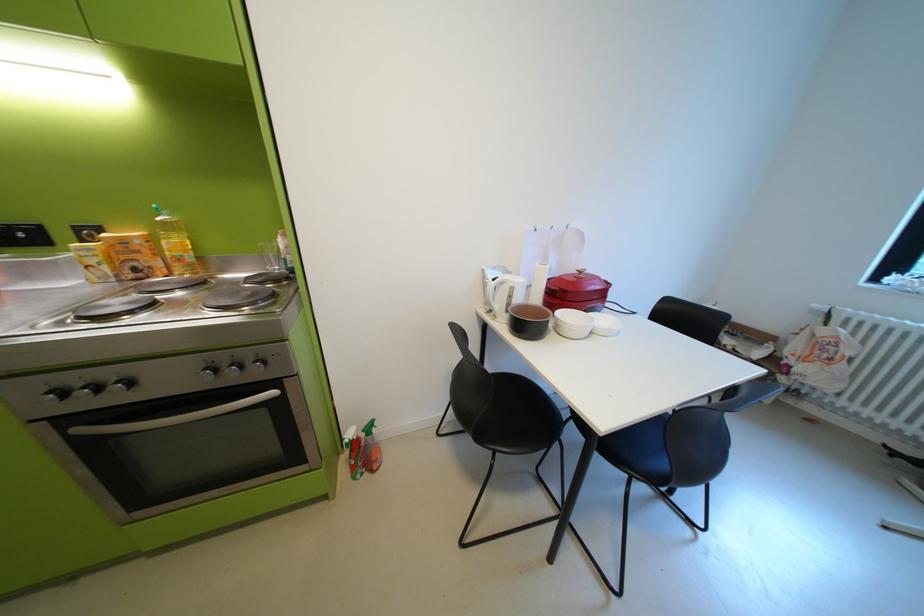
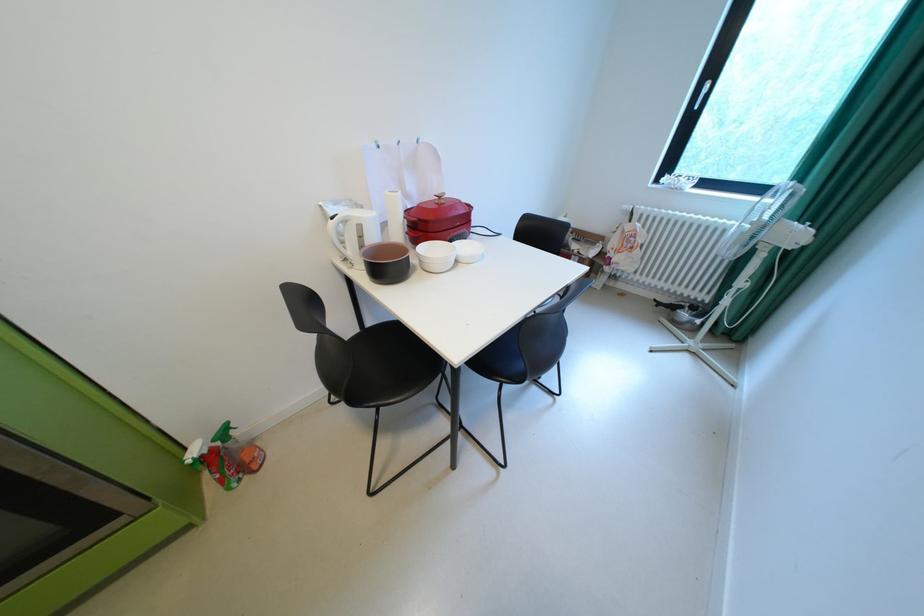
The point at (x=518, y=305) is marked in the first image. Where is the corresponding point in the second image?

(371, 246)